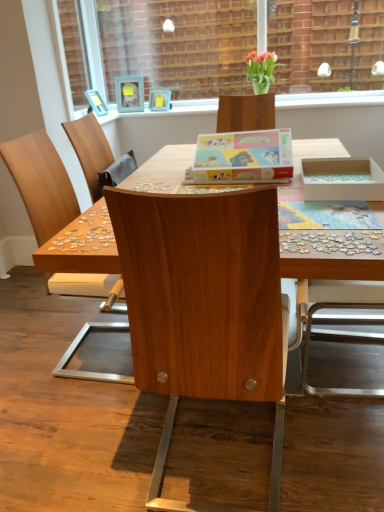
Question: From the image's perspective, is multicolored plastic puzzle pieces at right above wooden desk at center?

Choices:
 (A) yes
 (B) no

Answer: (A)

Question: Is multicolored plastic puzzle pieces at right to the right of wooden desk at center from the viewer's perspective?

Choices:
 (A) yes
 (B) no

Answer: (A)

Question: Is the depth of multicolored plastic puzzle pieces at right greater than that of wooden desk at center?

Choices:
 (A) yes
 (B) no

Answer: (A)

Question: From the image's perspective, is multicolored plastic puzzle pieces at right under wooden desk at center?

Choices:
 (A) yes
 (B) no

Answer: (B)

Question: Is multicolored plastic puzzle pieces at right looking in the opposite direction of wooden desk at center?

Choices:
 (A) yes
 (B) no

Answer: (A)

Question: Is point (221, 37) closer or farther from the camera than point (160, 108)?

Choices:
 (A) farther
 (B) closer

Answer: (B)

Question: Considering their positions, is brick wall at upper center located in front of or behind matte wooden picture frame at upper center, marked as the first picture frame in a right-to-left arrangement?

Choices:
 (A) front
 (B) behind

Answer: (A)

Question: Looking at their shapes, would you say brick wall at upper center is wider or thinner than matte wooden picture frame at upper center, the 2th picture frame in the left-to-right sequence?

Choices:
 (A) wide
 (B) thin

Answer: (B)

Question: From a real-world perspective, is brick wall at upper center positioned above or below matte wooden picture frame at upper center, marked as the first picture frame in a right-to-left arrangement?

Choices:
 (A) below
 (B) above

Answer: (B)

Question: From the image's perspective, is wooden desk at center above or below multicolored plastic puzzle pieces at right?

Choices:
 (A) above
 (B) below

Answer: (B)

Question: In the image, is wooden desk at center on the left side or the right side of multicolored plastic puzzle pieces at right?

Choices:
 (A) left
 (B) right

Answer: (A)

Question: Is wooden desk at center taller or shorter than multicolored plastic puzzle pieces at right?

Choices:
 (A) tall
 (B) short

Answer: (A)

Question: Is wooden desk at center in front of or behind multicolored plastic puzzle pieces at right in the image?

Choices:
 (A) behind
 (B) front

Answer: (B)

Question: Considering the positions of matte wooden picture frame at upper center, marked as the first picture frame in a right-to-left arrangement, and translucent glass vase at upper center in the image, is matte wooden picture frame at upper center, marked as the first picture frame in a right-to-left arrangement, taller or shorter than translucent glass vase at upper center?

Choices:
 (A) short
 (B) tall

Answer: (A)

Question: Looking at the image, does matte wooden picture frame at upper center, the 2th picture frame in the left-to-right sequence, seem bigger or smaller compared to translucent glass vase at upper center?

Choices:
 (A) small
 (B) big

Answer: (A)